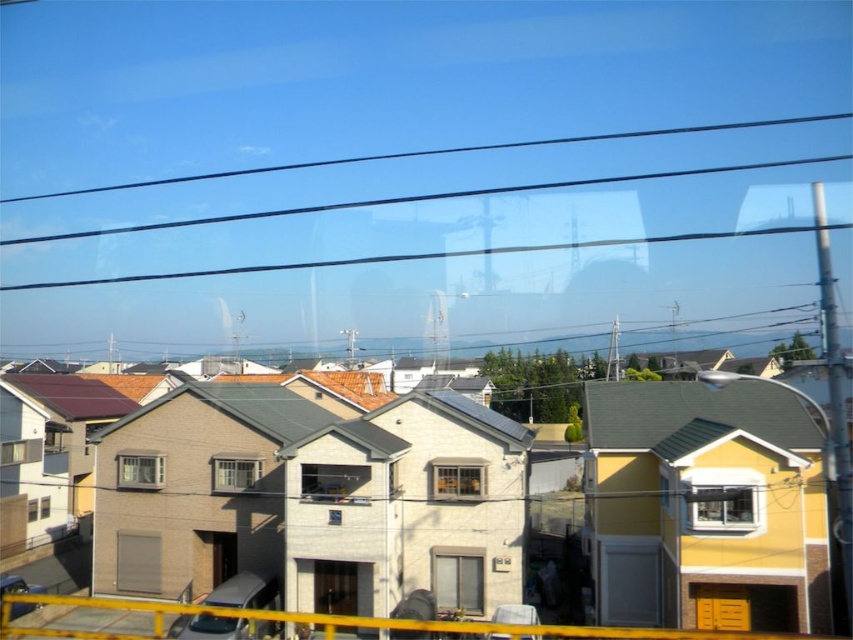
Question: Estimate the real-world distances between objects in this image. Which object is farther from the transparent glass power line at upper center?

Choices:
 (A) clear glass window at center
 (B) transparent glass window at center
 (C) matte glass window at center

Answer: (B)

Question: Which object is closer to the camera taking this photo?

Choices:
 (A) matte glass window at center
 (B) transparent glass window at center
 (C) clear glass window at center
 (D) transparent glass power line at upper center

Answer: (B)

Question: Is transparent glass power line at upper center to the right of matte glass window at center from the viewer's perspective?

Choices:
 (A) yes
 (B) no

Answer: (A)

Question: Which is nearer to the transparent glass power line at upper center?

Choices:
 (A) transparent glass window at center
 (B) matte glass window at center
 (C) clear glass window at center

Answer: (B)

Question: Does transparent glass window at center have a larger size compared to clear glass window at center?

Choices:
 (A) yes
 (B) no

Answer: (A)

Question: Can you confirm if transparent glass window at center is positioned to the left of clear glass window at center?

Choices:
 (A) no
 (B) yes

Answer: (A)